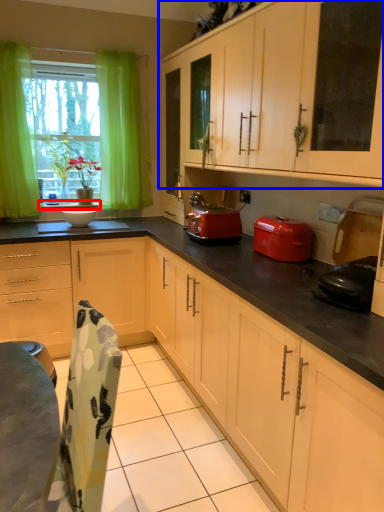
Question: Which of the following is the closest to the observer, window sill (highlighted by a red box) or cabinetry (highlighted by a blue box)?

Choices:
 (A) window sill
 (B) cabinetry

Answer: (B)